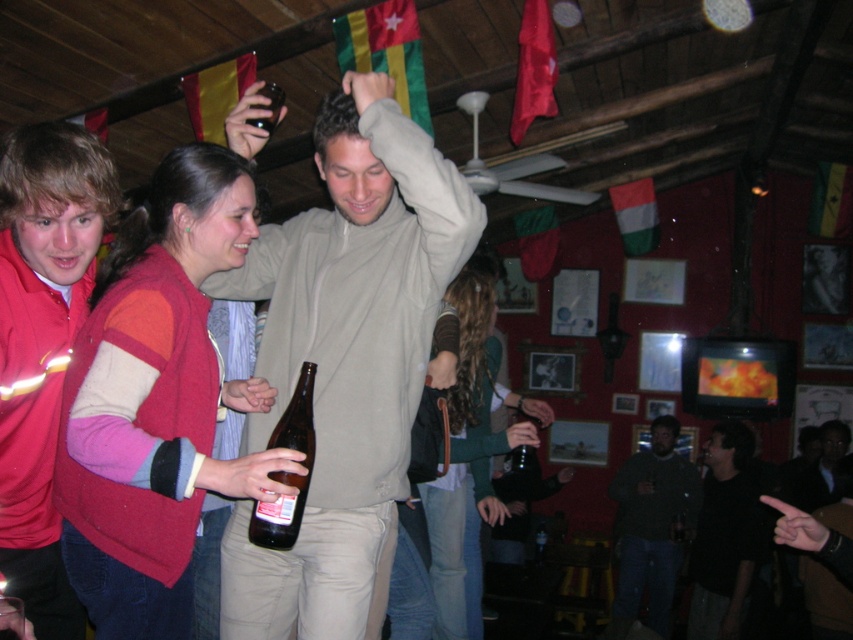
You are at a party and want to talk to both the person in the green textured sweater at center and the person in the dark gray fabric shirt at center. Which one can you see more clearly from your current position?

The green textured sweater at center is in front of the dark gray fabric shirt at center, so you can see the green textured sweater at center more clearly.

You are standing at the entrance of the room and want to greet the person wearing the knitted sweater at center. Based on their position, in which direction should you walk to reach them?

The knitted sweater at center is located at point 0.623 on the x axis and 0.184 on the y axis. Since you are at the entrance, you should walk towards the center of the room to reach them.